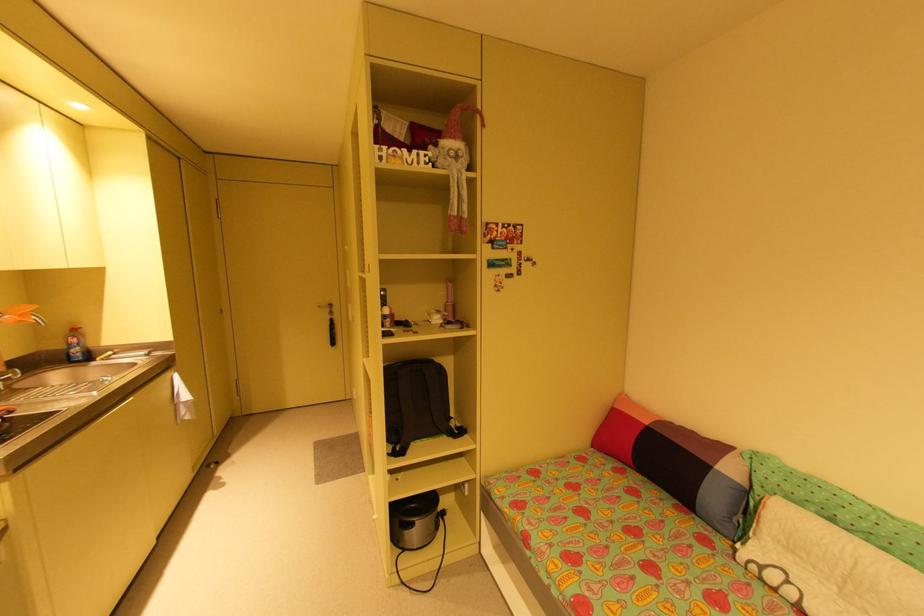
Identify the location of silver door handle. (325, 305).